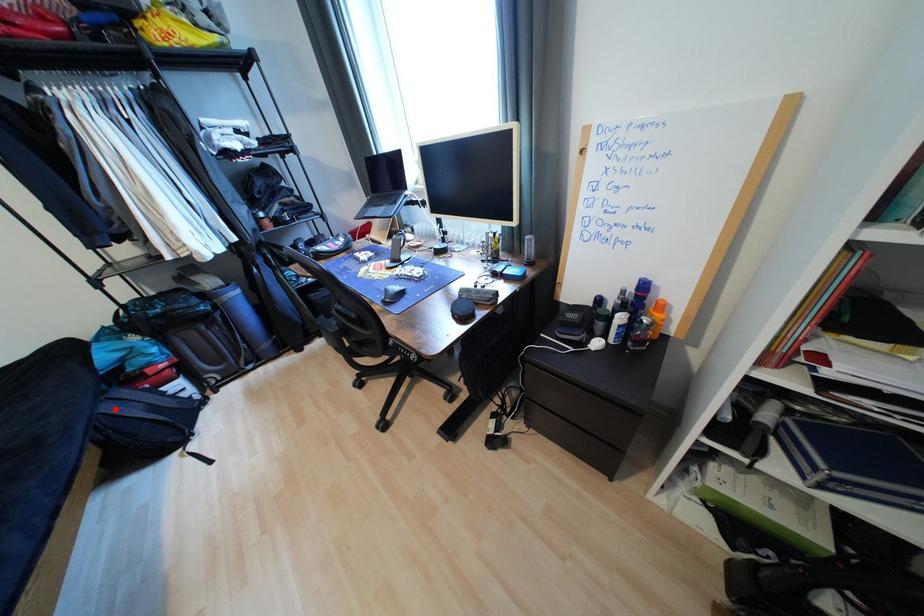
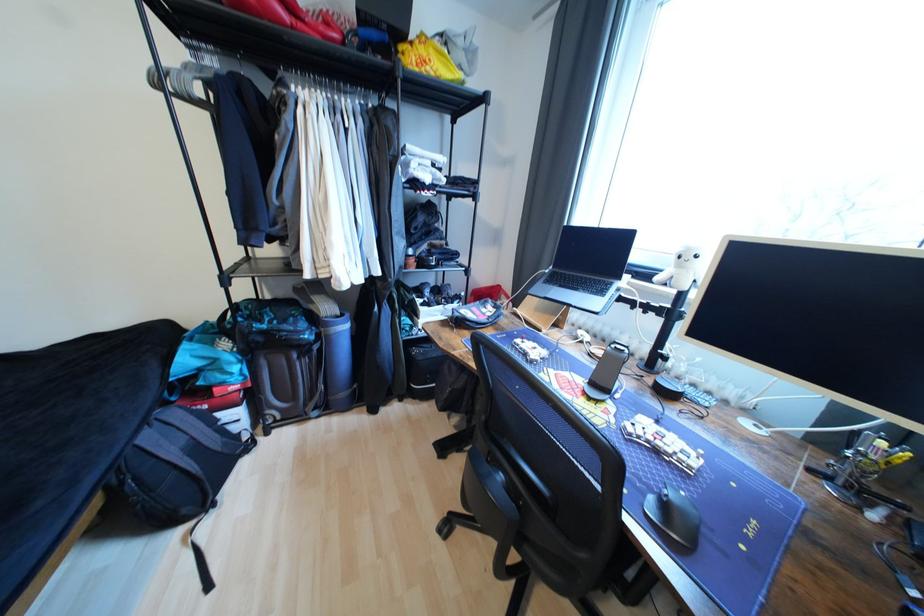
Find the pixel in the second image that matches the highlighted location in the first image.

(155, 439)